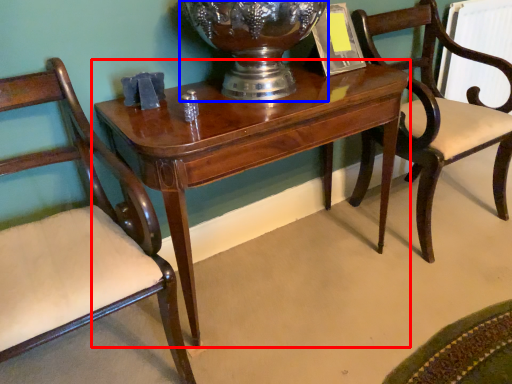
Question: Which object is closer to the camera taking this photo, table (highlighted by a red box) or glass vase (highlighted by a blue box)?

Choices:
 (A) table
 (B) glass vase

Answer: (A)